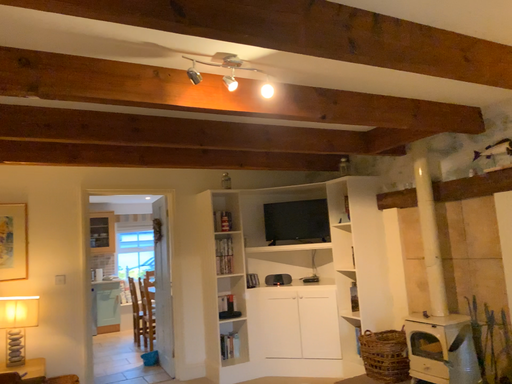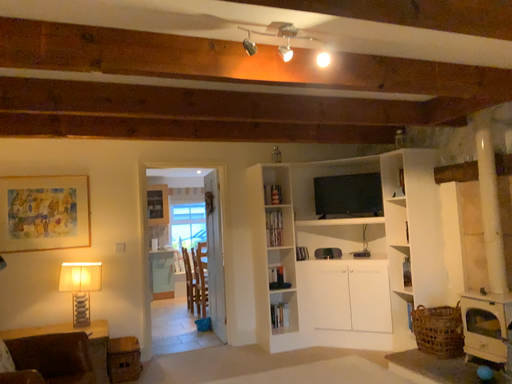
Question: How did the camera likely rotate when shooting the video?

Choices:
 (A) rotated right
 (B) rotated left

Answer: (B)